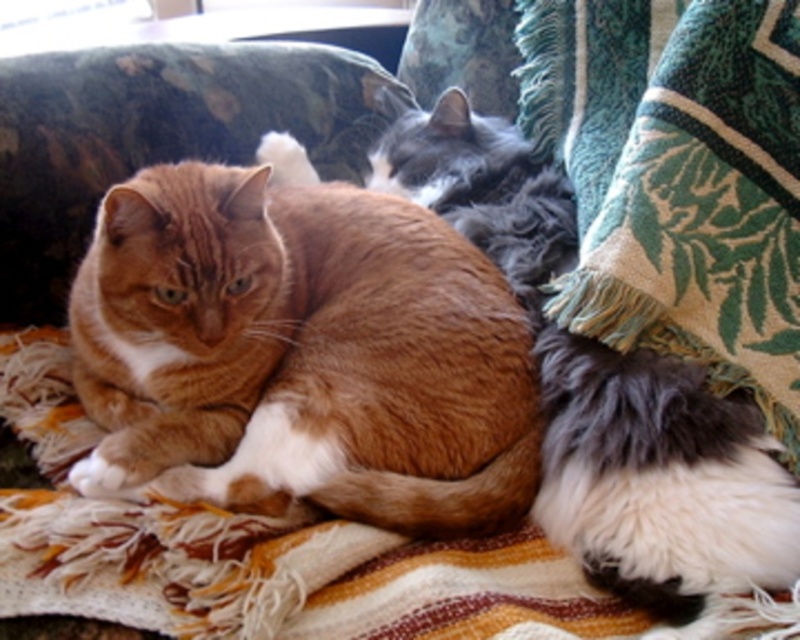
Where is the orange tabby cat at center located in the image?

The orange tabby cat at center is located at point (300, 353).

You are a photographer trying to capture a closeup of the ginger tabby cat with white markings on its chest and paws. You notice two points in the image labeled as point (233, 432) and point (648, 176). Which point should you focus on to get the best closeup of the ginger tabby cat?

You should focus on point (233, 432) because it is closer to the camera than point (648, 176), allowing for a better closeup of the ginger tabby cat.

You are a photographer trying to capture a photo of the orange tabby cat at center and the green woven blanket at lower right. You want to ensure both are in the frame. Based on their positions, which object is closer to the left side of the image?

The orange tabby cat at center is to the left of the green woven blanket at lower right, so it is closer to the left side of the image.